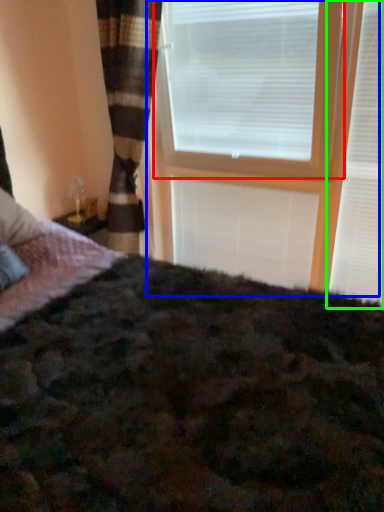
Question: Considering the real-world distances, which object is closest to window blind (highlighted by a red box)? window frame (highlighted by a blue box) or window blind (highlighted by a green box).

Choices:
 (A) window frame
 (B) window blind

Answer: (A)